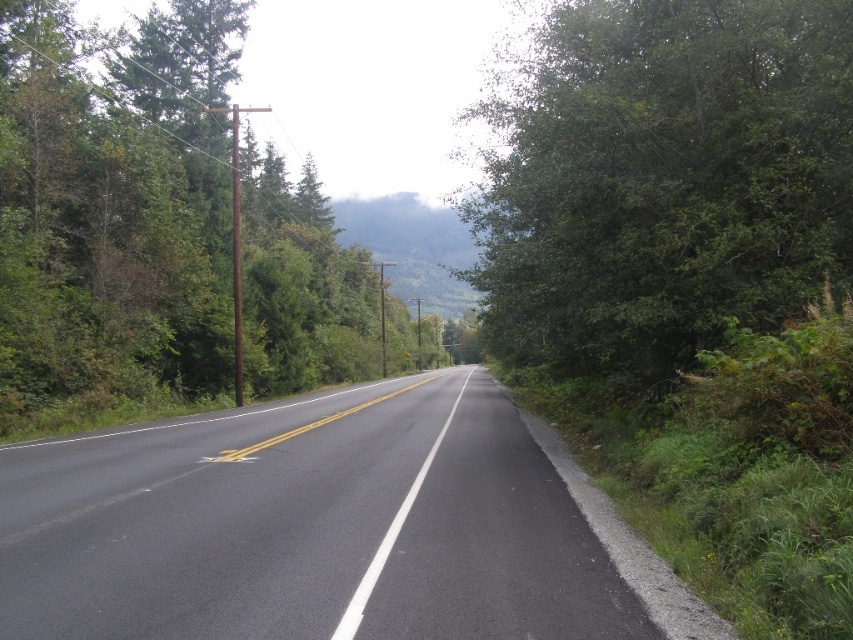
You are a delivery driver navigating a narrow two lane road. You need to make a quick stop. There is a point at coordinates (306,525). Is this point on the road where you can safely stop your vehicle?

The point at coordinates (306,525) is on the black asphalt road at center, so yes, it is a safe location to stop your vehicle as it is on the road surface.

You are a delivery driver navigating a route and need to stay on the black asphalt road at center. According to the map, the road is at coordinates point 0.822, 0.361. If your GPS shows you are at point 0.820, 0.360, are you currently on the road?

Yes, you are on the black asphalt road at center because your current coordinates [306,524] are very close to the road coordinates [306,525].

You are a driver approaching the road shown in the image. You need to determine the position of the green leafy tree at left relative to the road. Is the tree located to the left or right side of the road?

The green leafy tree at left is located on the left side of the road.